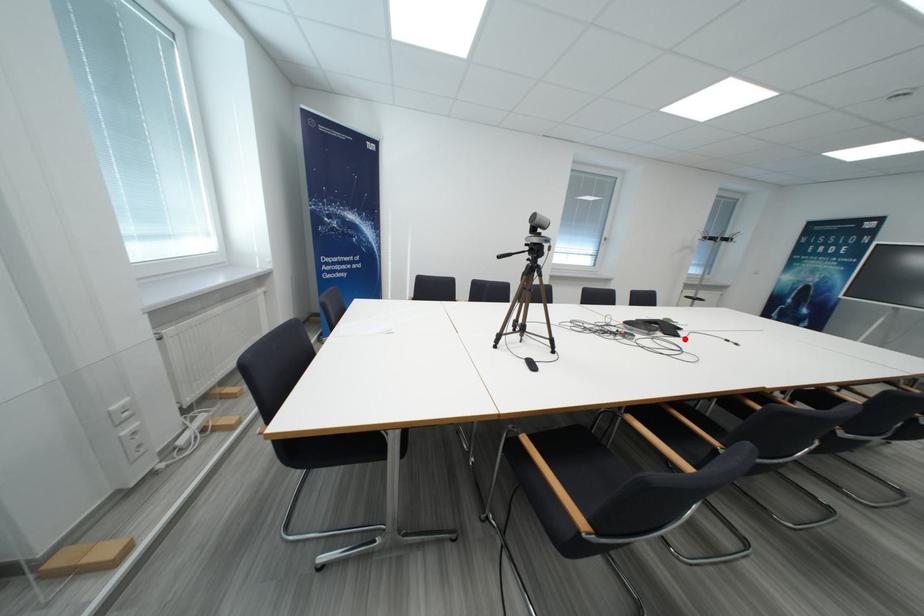
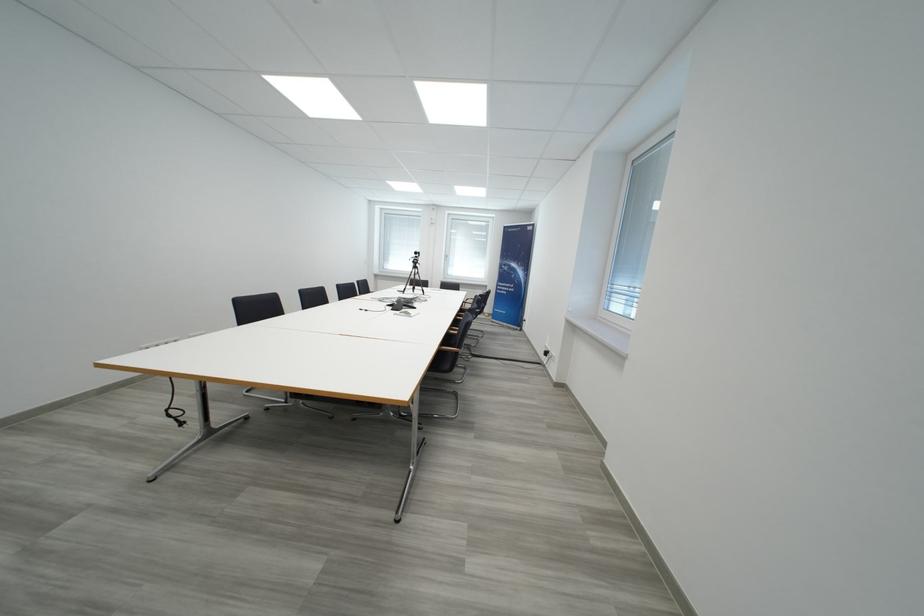
Locate, in the second image, the point that corresponds to the highlighted location in the first image.

(395, 309)